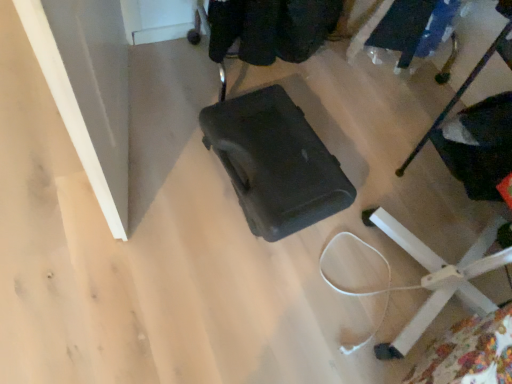
Question: From the image's perspective, relative to matte black suitcase at center, is white plastic chair at lower right above or below?

Choices:
 (A) above
 (B) below

Answer: (B)

Question: Considering the positions of white plastic chair at lower right and matte black suitcase at center in the image, is white plastic chair at lower right wider or thinner than matte black suitcase at center?

Choices:
 (A) wide
 (B) thin

Answer: (A)

Question: Considering the relative positions of white plastic chair at lower right and matte black suitcase at center in the image provided, is white plastic chair at lower right to the left or to the right of matte black suitcase at center?

Choices:
 (A) left
 (B) right

Answer: (B)

Question: Is matte black suitcase at center wider or thinner than white plastic chair at lower right?

Choices:
 (A) thin
 (B) wide

Answer: (A)

Question: Looking at the image, does matte black suitcase at center seem bigger or smaller compared to white plastic chair at lower right?

Choices:
 (A) small
 (B) big

Answer: (A)

Question: In the image, is matte black suitcase at center positioned in front of or behind white plastic chair at lower right?

Choices:
 (A) front
 (B) behind

Answer: (B)

Question: From a real-world perspective, relative to white plastic chair at lower right, is matte black suitcase at center vertically above or below?

Choices:
 (A) below
 (B) above

Answer: (A)